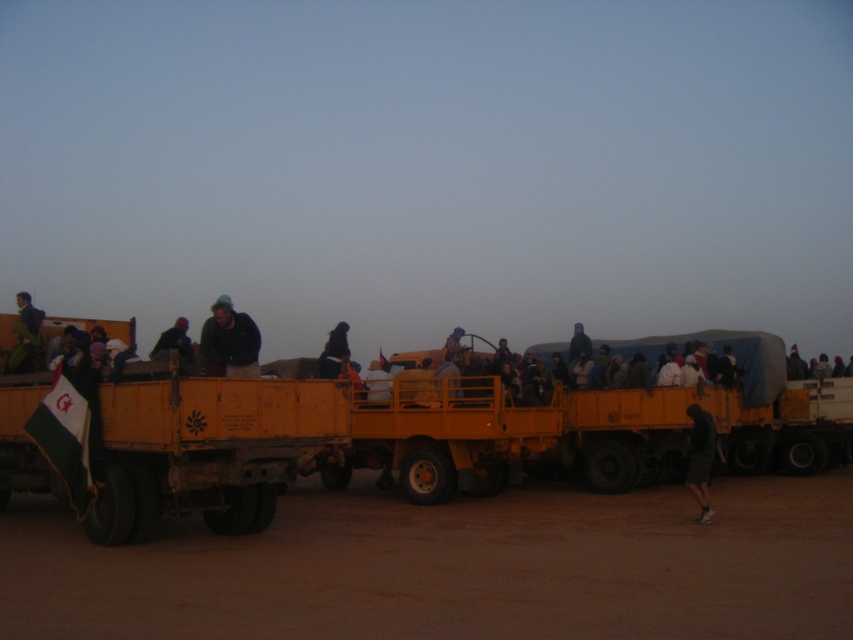
Question: Among these objects, which one is farthest from the camera?

Choices:
 (A) dark matte jacket at center
 (B) matte black jacket at center
 (C) light brown leather jacket at center

Answer: (C)

Question: Is dark matte jacket at center above matte black jacket at center?

Choices:
 (A) no
 (B) yes

Answer: (B)

Question: Which object is closer to the camera taking this photo?

Choices:
 (A) matte yellow truck at center
 (B) dark matte jacket at center

Answer: (A)

Question: Which is farther from the brown sandy dirt at lower center?

Choices:
 (A) matte black jacket at center
 (B) light brown leather jacket at center

Answer: (B)

Question: Is dark matte jacket at center smaller than black fabric at center?

Choices:
 (A) no
 (B) yes

Answer: (B)

Question: Observing the image, what is the correct spatial positioning of matte yellow truck at center in reference to black fabric at center?

Choices:
 (A) right
 (B) left

Answer: (A)